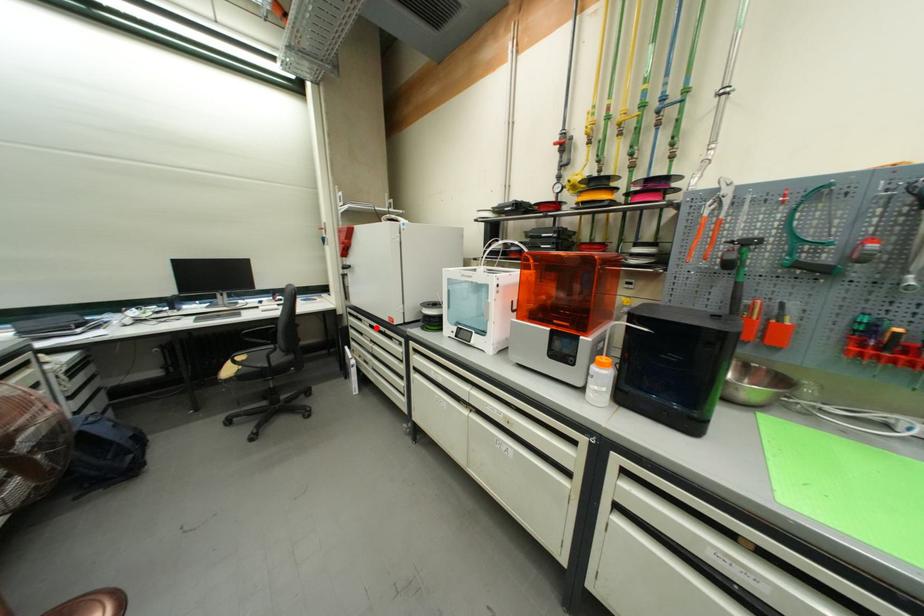
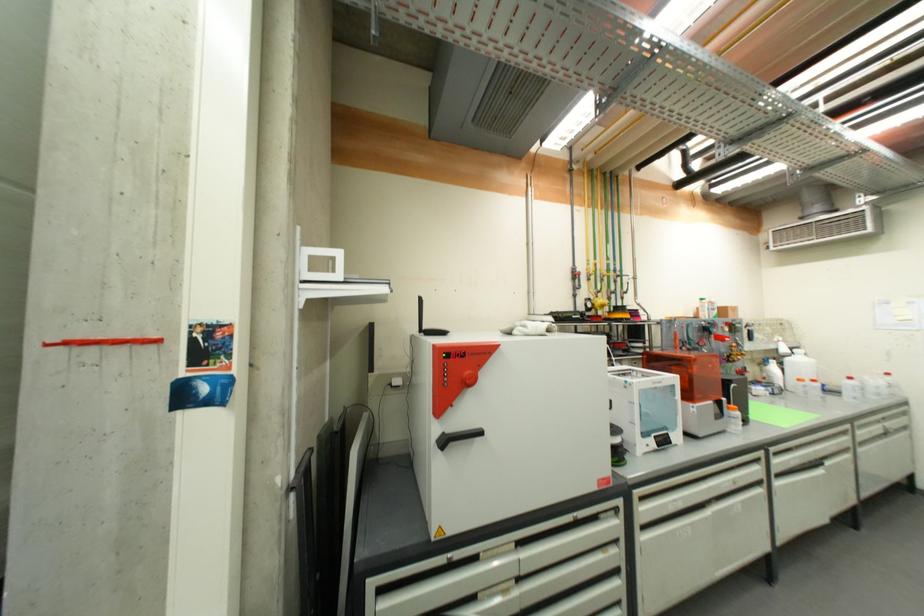
Question: I am providing you with two images of the same scene from different viewpoints. A red point is shown in image1. For the corresponding object point in image2, is it positioned nearer or farther from the camera?

Choices:
 (A) Nearer
 (B) Farther

Answer: (A)